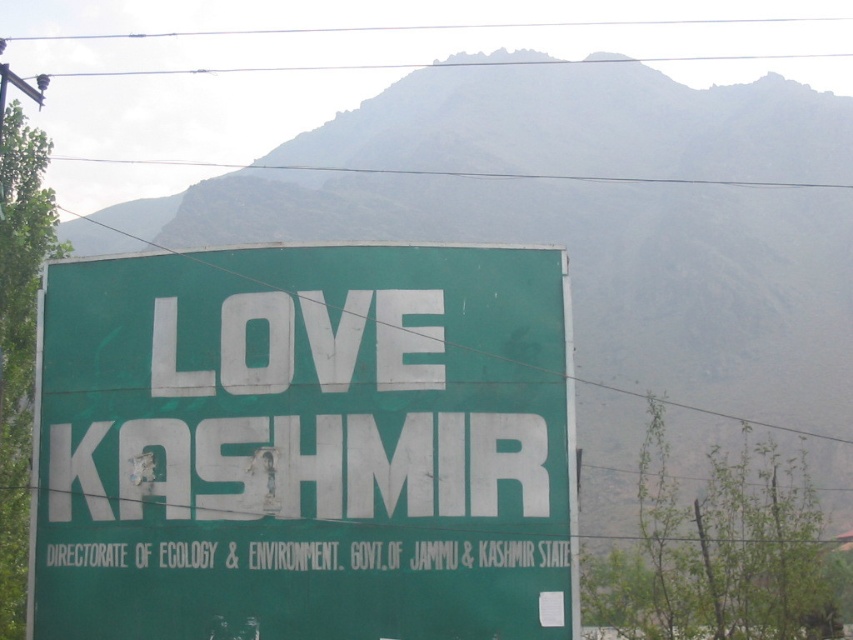
You are a hiker who has just reached a viewpoint overlooking a valley. You see a green matte signboard at center and a green textured mountain at upper center. Which object is located higher up in the scene?

The green textured mountain at upper center is higher up in the scene than the green matte signboard at center, as the signboard is positioned below the mountain.

You are a photographer planning to capture the green matte signboard at center and the green textured mountain at upper center in a single frame. Based on their sizes, which object would appear smaller in the photo?

The green matte signboard at center would appear smaller in the photo because its width is less than that of the green textured mountain at upper center.